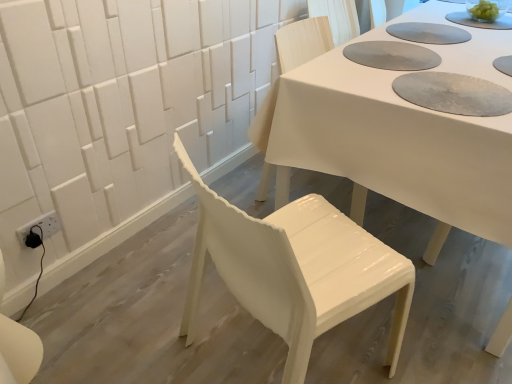
Locate an element on the screen. This screenshot has height=384, width=512. vacant region under textured gray paper plate at upper center (from a real-world perspective) is located at coordinates (375, 49).